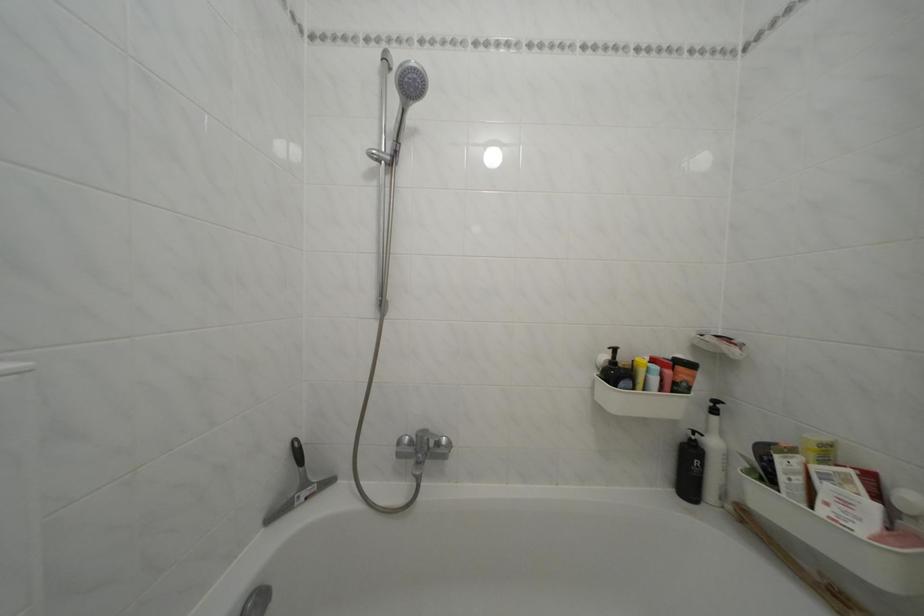
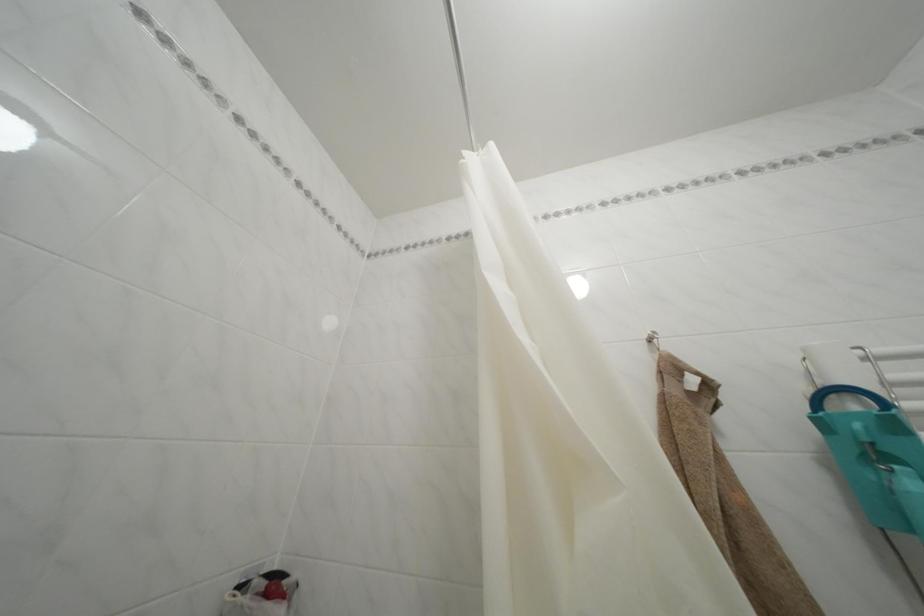
First-person continuous shooting, in which direction is the camera rotating?

The rotation direction of the camera is right-up.